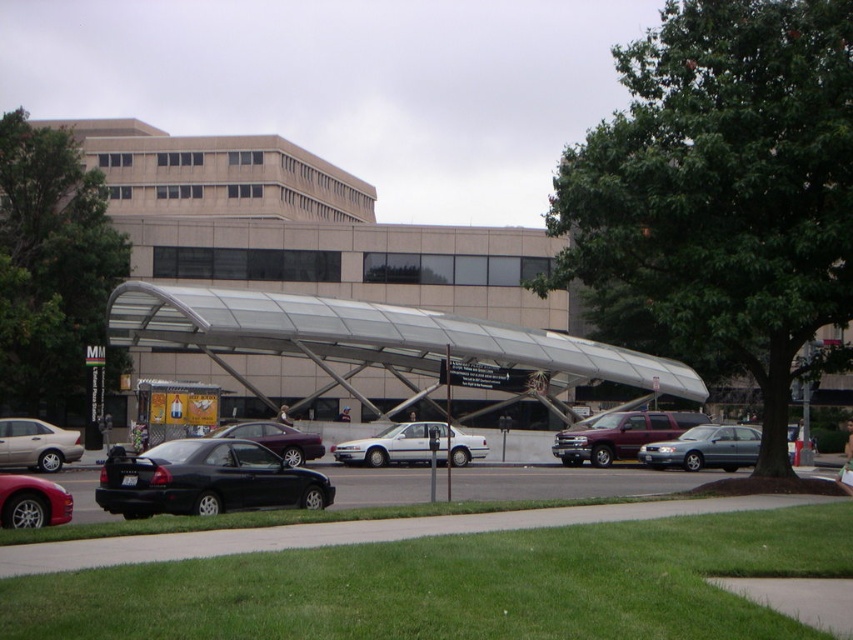
Is point (19, 481) positioned in front of point (273, 451)?

Yes, point (19, 481) is closer to viewer.

Who is lower down, shiny red sedan at lower left or shiny black sedan at center?

shiny black sedan at center

The width and height of the screenshot is (853, 640). I want to click on shiny red sedan at lower left, so click(32, 502).

Is transparent glass bus stop at center to the right of metallic silver sedan at left from the viewer's perspective?

Indeed, transparent glass bus stop at center is positioned on the right side of metallic silver sedan at left.

Who is taller, transparent glass bus stop at center or metallic silver sedan at left?

With more height is transparent glass bus stop at center.

Does point (541, 380) come in front of point (28, 419)?

No, it is not.

The image size is (853, 640). Identify the location of transparent glass bus stop at center. (386, 346).

Between point (409, 381) and point (403, 440), which one is positioned in front?

Point (403, 440) is in front.

Image resolution: width=853 pixels, height=640 pixels. Find the location of `transparent glass bus stop at center`. transparent glass bus stop at center is located at coordinates (386, 346).

The width and height of the screenshot is (853, 640). Identify the location of transparent glass bus stop at center. (386, 346).